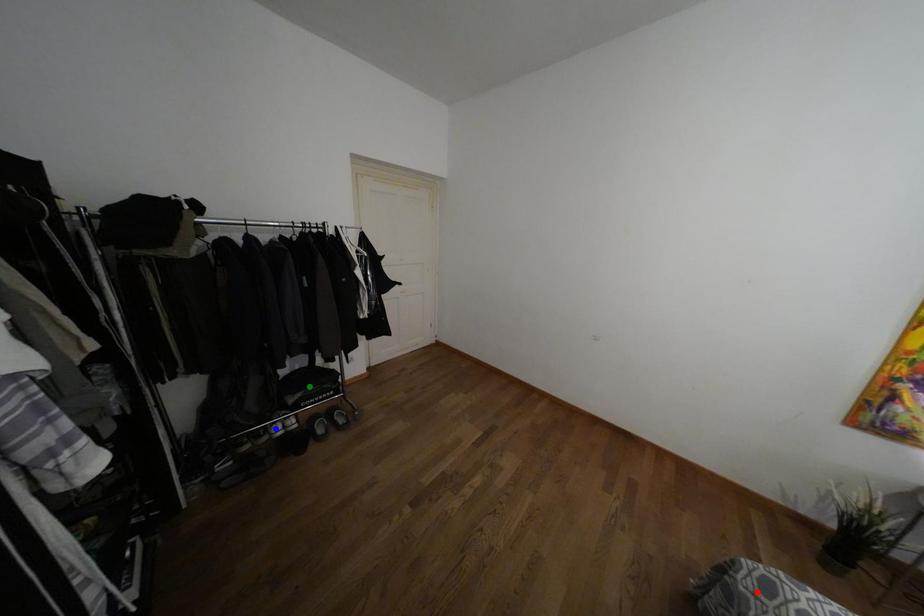
Order these from nearest to farthest:
green point | blue point | red point

red point → blue point → green point